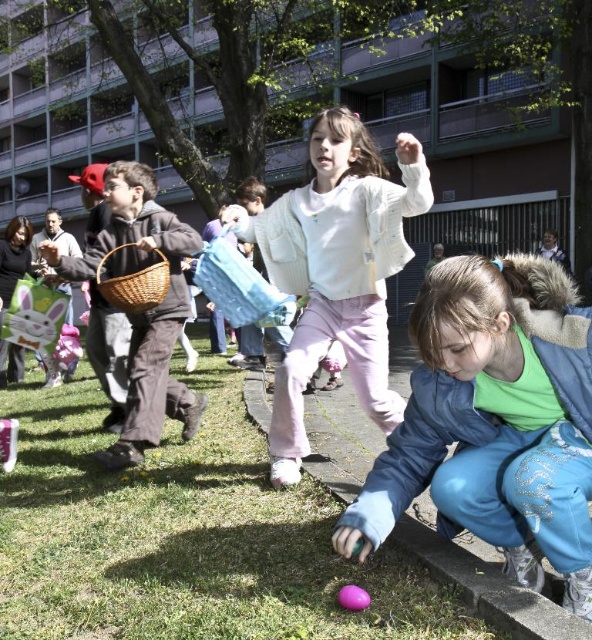
Question: Estimate the real-world distances between objects in this image. Which object is closer to the woven brown basket at left?

Choices:
 (A) green fleece jacket at lower right
 (B) green grass at lower left
 (C) matte brown wicker basket at left
 (D) white fuzzy sweater at center

Answer: (C)

Question: Can you confirm if green grass at lower left is positioned above white fuzzy sweater at center?

Choices:
 (A) no
 (B) yes

Answer: (A)

Question: Is green fleece jacket at lower right below white fuzzy sweater at center?

Choices:
 (A) yes
 (B) no

Answer: (A)

Question: Which of the following is the closest to the observer?

Choices:
 (A) woven brown basket at left
 (B) white fuzzy sweater at center
 (C) green grass at lower left
 (D) green fleece jacket at lower right

Answer: (D)

Question: Is green fleece jacket at lower right below woven brown basket at left?

Choices:
 (A) yes
 (B) no

Answer: (A)

Question: Which object appears farthest from the camera in this image?

Choices:
 (A) green fleece jacket at lower right
 (B) white fuzzy sweater at center
 (C) green grass at lower left
 (D) matte brown wicker basket at left

Answer: (D)